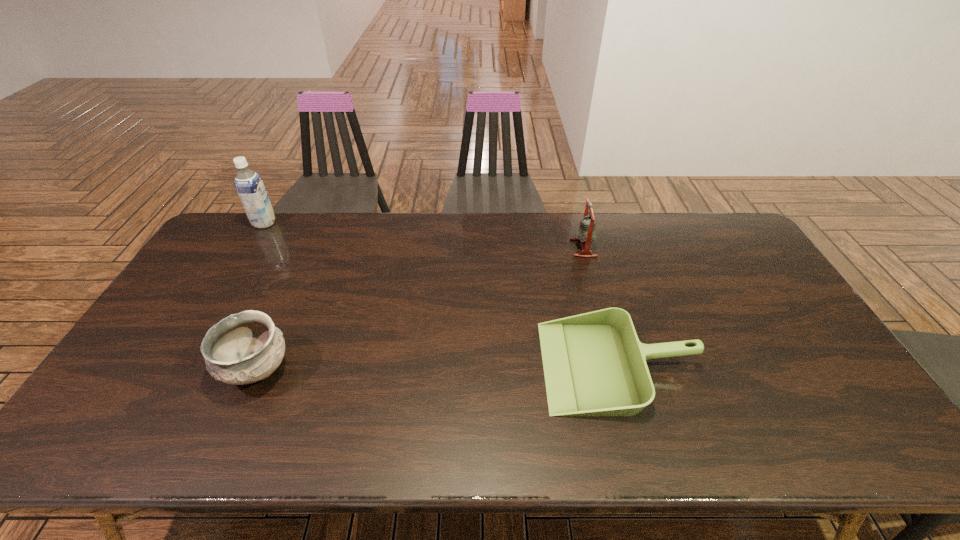
Locate an element on the screen. Image resolution: width=960 pixels, height=540 pixels. vacant space that satisfies the following two spatial constraints: 1. on the label of the third shortest object; 2. on the right side of the tallest object is located at coordinates (250, 248).

This screenshot has width=960, height=540. I want to click on free spot that satisfies the following two spatial constraints: 1. on the label of the tallest object; 2. on the right side of the second shortest object, so click(x=176, y=370).

Identify the location of free space that satisfies the following two spatial constraints: 1. on the back side of the bell; 2. on the label of the tallest object. (577, 223).